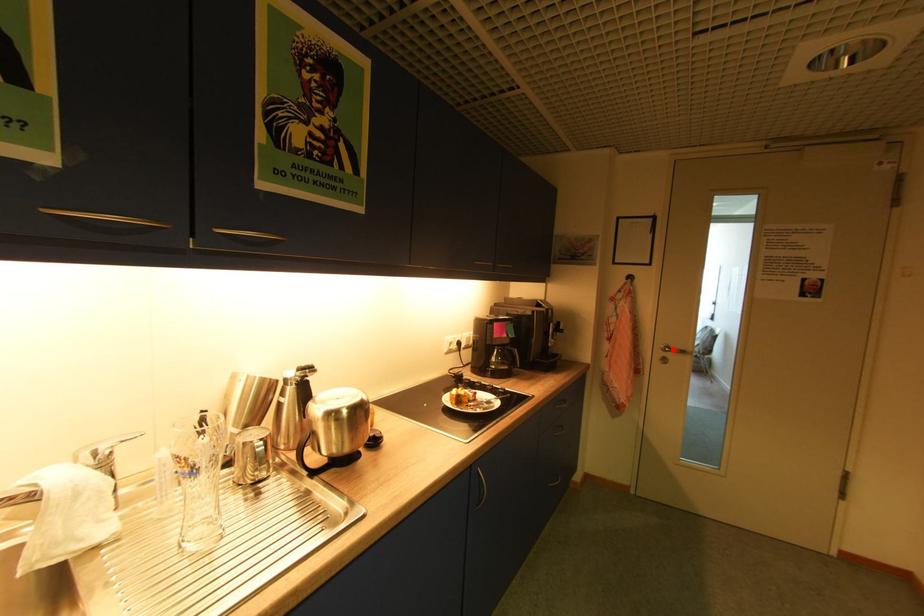
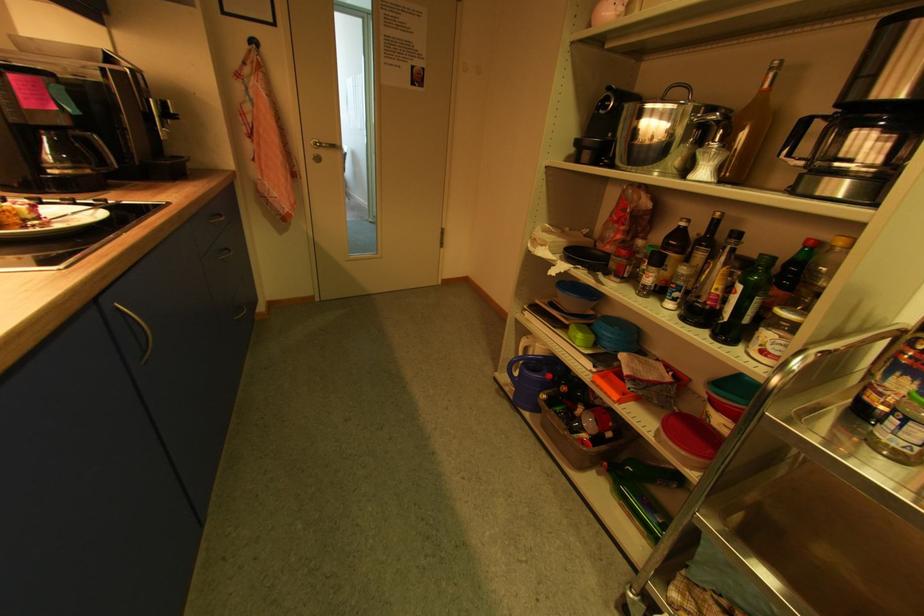
The point at the highlighted location is marked in the first image. Where is the corresponding point in the second image?

(323, 146)